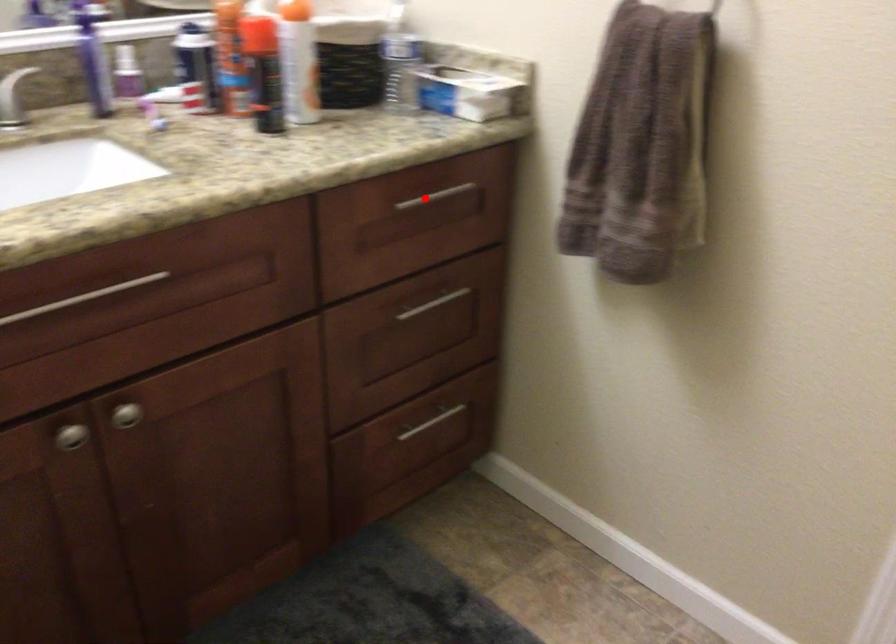
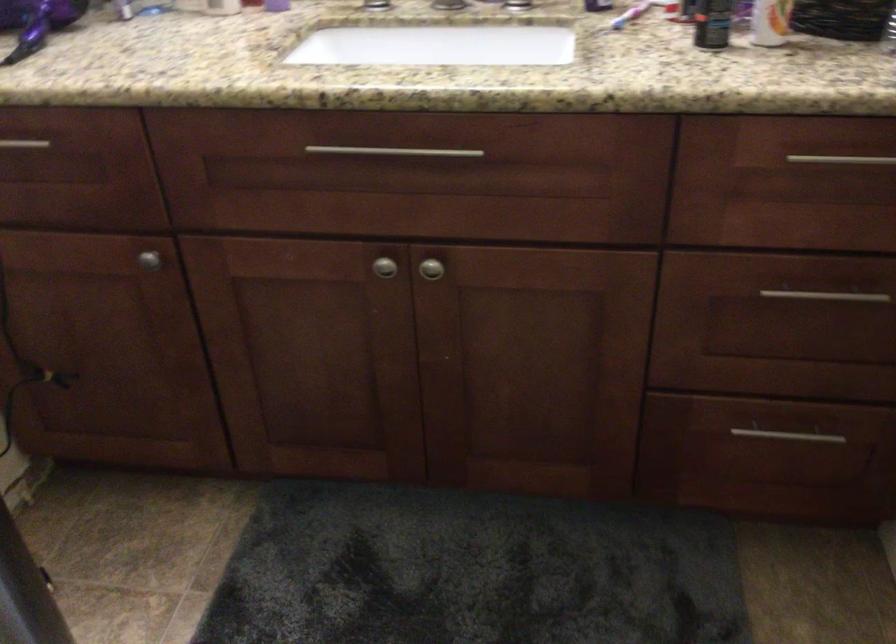
Question: I am providing you with two images of the same scene from different viewpoints. Given a red point in image1, look at the same physical point in image2. Is it:

Choices:
 (A) Closer to the viewpoint
 (B) Farther from the viewpoint

Answer: (A)